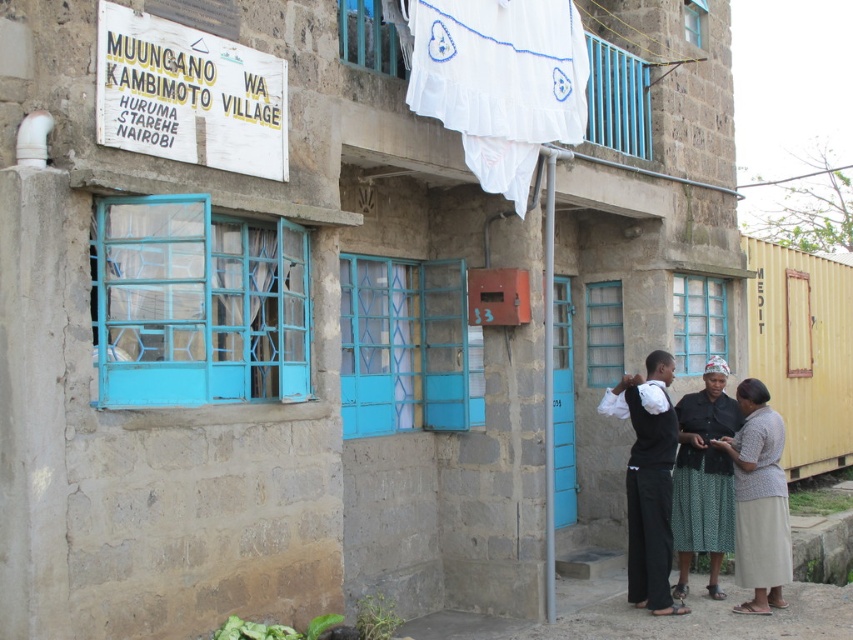
Is dark green textured skirt at center wider than white textured skirt at lower right?

Indeed, dark green textured skirt at center has a greater width compared to white textured skirt at lower right.

Is dark green textured skirt at center shorter than white textured skirt at lower right?

Incorrect, dark green textured skirt at center's height does not fall short of white textured skirt at lower right's.

Is point (711, 588) in front of point (779, 497)?

No, it is behind (779, 497).

You are a GUI agent. You are given a task and a screenshot of the screen. Output one action in this format:
    pyautogui.click(x=<x>, y=<y>)
    Task: Click on the dark green textured skirt at center
    This screenshot has width=853, height=640.
    Given the screenshot: What is the action you would take?
    pyautogui.click(x=703, y=477)

Is white fabric at upper center smaller than white textured skirt at lower right?

No, white fabric at upper center is not smaller than white textured skirt at lower right.

Which of these two, white fabric at upper center or white textured skirt at lower right, stands shorter?

white fabric at upper center

Is point (534, 138) more distant than point (782, 448)?

No, (534, 138) is closer to viewer.

At what (x,y) coordinates should I click in order to perform the action: click on white fabric at upper center. Please return your answer as a coordinate pair (x, y). This screenshot has height=640, width=853. Looking at the image, I should click on (500, 81).

Identify the location of white fabric at upper center. (500, 81).

Between white fabric at upper center and black matte pants at lower center, which one is positioned higher?

white fabric at upper center is above.

Between point (537, 99) and point (670, 410), which one is positioned in front?

Point (537, 99) is more forward.

The image size is (853, 640). In order to click on white fabric at upper center in this screenshot , I will do `click(500, 81)`.